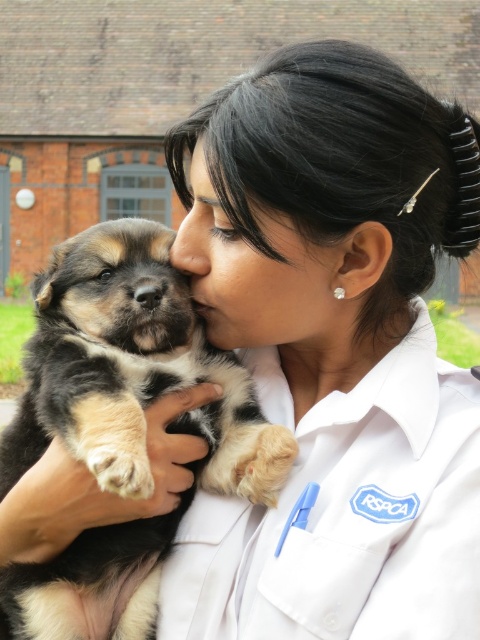
Question: Observing the image, what is the correct spatial positioning of white smooth lab coat at center in reference to soft fur puppy at center?

Choices:
 (A) left
 (B) right

Answer: (B)

Question: Is white smooth lab coat at center below soft fur puppy at center?

Choices:
 (A) no
 (B) yes

Answer: (B)

Question: Which object is farther from the camera taking this photo?

Choices:
 (A) white smooth lab coat at center
 (B) soft fur puppy at center

Answer: (A)

Question: Is white smooth lab coat at center closer to the viewer compared to soft fur puppy at center?

Choices:
 (A) yes
 (B) no

Answer: (B)

Question: Which point is farther from the camera taking this photo?

Choices:
 (A) (8, 451)
 (B) (383, 486)

Answer: (A)